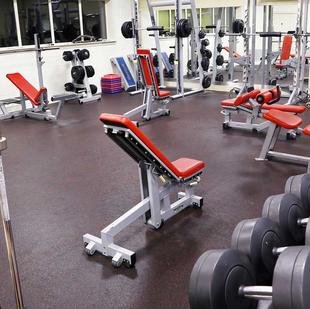
Identify the location of dumbbells. The image size is (310, 309). (294, 188), (286, 209), (258, 235), (222, 263).